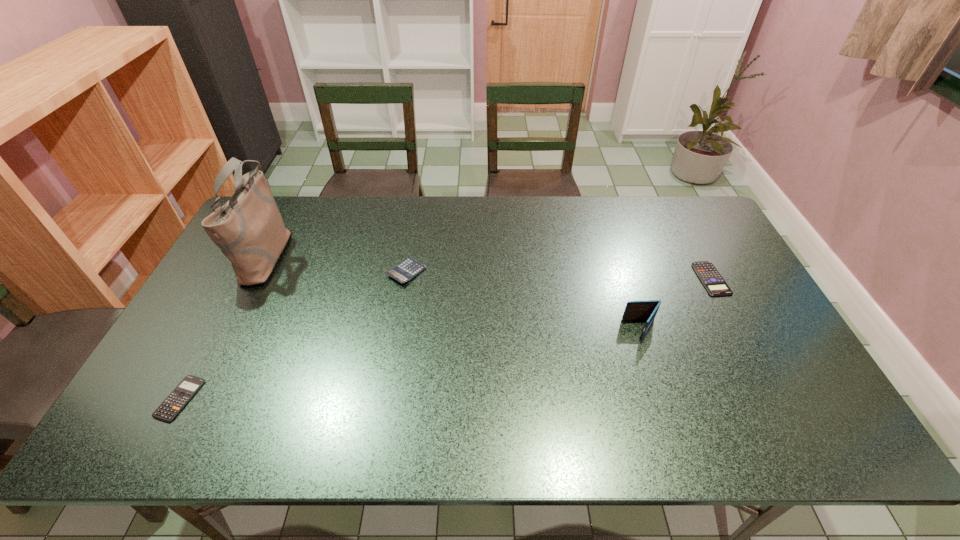
This screenshot has width=960, height=540. Identify the location of the third closest calculator to the shoulder bag. (712, 280).

This screenshot has height=540, width=960. What are the coordinates of `calculator that is the closest to the shoulder bag` in the screenshot? It's located at (186, 389).

Identify the location of vacant area that satisfies the following two spatial constraints: 1. on the front-facing side of the third object from right to left; 2. on the left side of the tallest object. (258, 272).

The height and width of the screenshot is (540, 960). Identify the location of blank space that satisfies the following two spatial constraints: 1. on the back side of the shortest object; 2. on the right side of the third shortest object. (248, 272).

You are a GUI agent. You are given a task and a screenshot of the screen. Output one action in this format:
    pyautogui.click(x=<x>, y=<y>)
    Task: Click on the vacant area that satisfies the following two spatial constraints: 1. on the exterior surface of the fourth object from left to right; 2. on the front side of the shortest object
    The image size is (960, 540).
    Given the screenshot: What is the action you would take?
    coord(663,399)

Find the location of a particular element. The width and height of the screenshot is (960, 540). free space that satisfies the following two spatial constraints: 1. on the front-facing side of the second calculator from left to right; 2. on the left side of the shoulder bag is located at coordinates (258, 272).